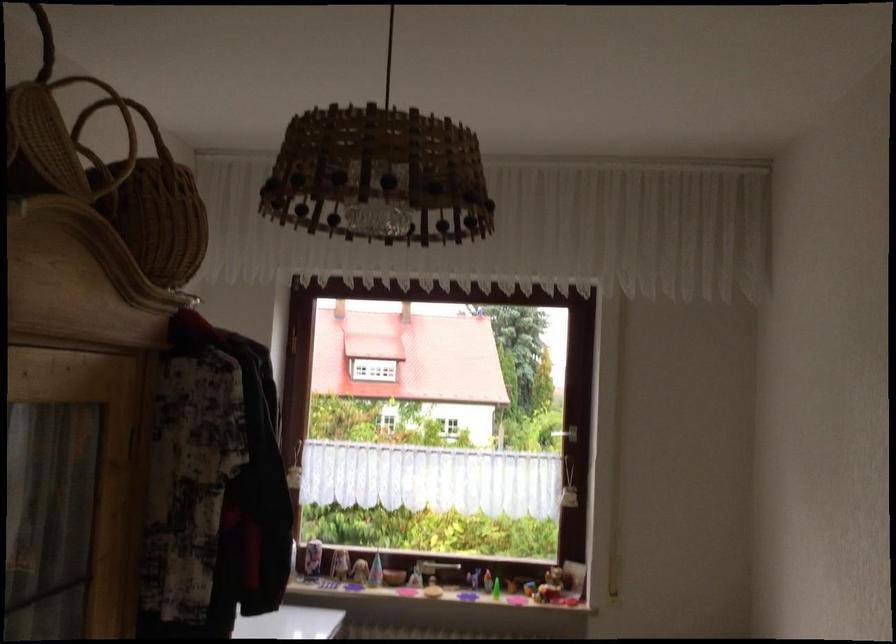
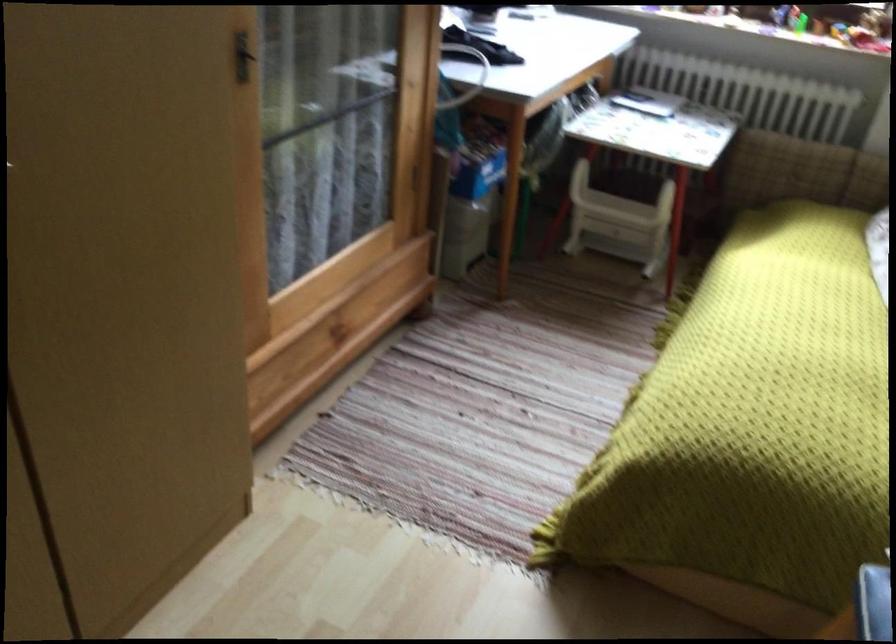
First-person continuous shooting, in which direction is the camera rotating?

The camera rotated toward left-down.